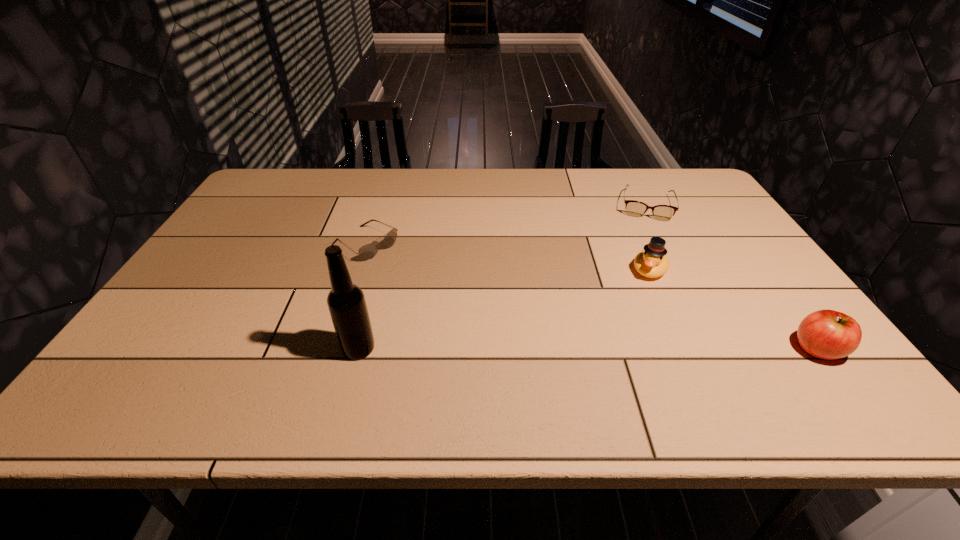
Image resolution: width=960 pixels, height=540 pixels. Find the location of `vacant point located 0.160m on the face of the farthest object`. vacant point located 0.160m on the face of the farthest object is located at coordinates (646, 253).

At what (x,y) coordinates should I click in order to perform the action: click on free spot located 0.130m on the face of the farthest object. Please return your answer as a coordinate pair (x, y). Looking at the image, I should click on (646, 247).

At what (x,y) coordinates should I click in order to perform the action: click on free space located 0.360m on the face of the farthest object. Please return your answer as a coordinate pair (x, y). The width and height of the screenshot is (960, 540). Looking at the image, I should click on (645, 300).

The height and width of the screenshot is (540, 960). Find the location of `free region located 0.200m on the front-facing side of the duck`. free region located 0.200m on the front-facing side of the duck is located at coordinates (625, 332).

Identify the location of free point located on the front-facing side of the duck. The height and width of the screenshot is (540, 960). (609, 368).

Where is `vacant space situated on the front-facing side of the duck`? vacant space situated on the front-facing side of the duck is located at coordinates (641, 293).

The width and height of the screenshot is (960, 540). I want to click on object that is at the far edge, so click(x=634, y=208).

This screenshot has height=540, width=960. In order to click on beer bottle situated at the near edge in this screenshot , I will do (347, 306).

Where is `apple that is at the near edge`? apple that is at the near edge is located at coordinates (827, 334).

The image size is (960, 540). What are the coordinates of `apple that is at the right edge` in the screenshot? It's located at (827, 334).